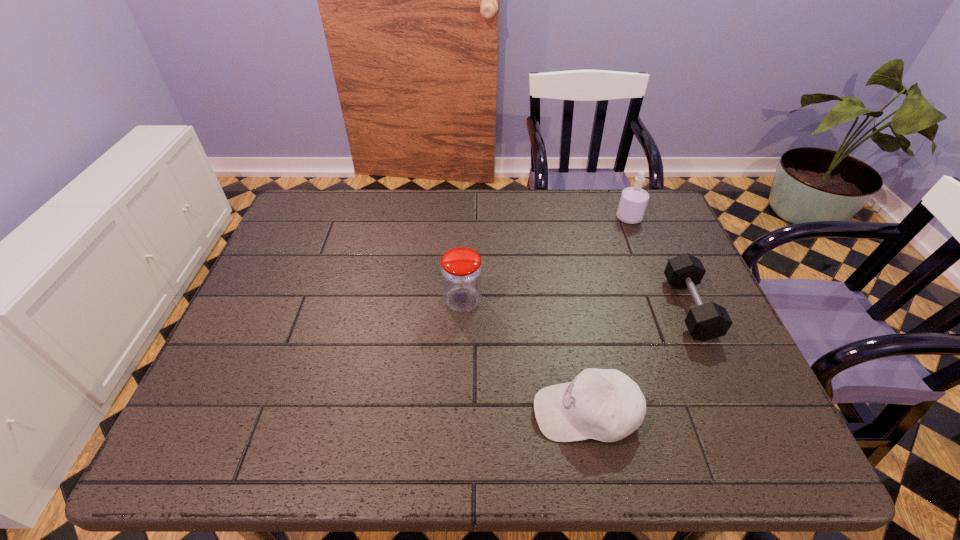
This screenshot has width=960, height=540. In order to click on perfume in this screenshot , I will do `click(633, 201)`.

Find the location of a particular element. This screenshot has width=960, height=540. the leftmost object is located at coordinates (461, 272).

Locate an element on the screen. the second object from left to right is located at coordinates pyautogui.click(x=603, y=404).

Where is `the nearest object`? The height and width of the screenshot is (540, 960). the nearest object is located at coordinates (603, 404).

Where is `the shortest object`? the shortest object is located at coordinates (707, 321).

This screenshot has width=960, height=540. Identify the location of free location located on the front of the farthest object. (670, 322).

The height and width of the screenshot is (540, 960). I want to click on free space located 0.260m on the left of the jar, so click(342, 301).

Where is `free point located 0.140m on the front-facing side of the baseball cap`? This screenshot has height=540, width=960. free point located 0.140m on the front-facing side of the baseball cap is located at coordinates (466, 413).

Identify the location of vacant space located 0.120m on the front-facing side of the baseball cap. (475, 413).

Identify the location of vacant space situated 0.250m on the front-facing side of the baseball cap. The image size is (960, 540). (412, 413).